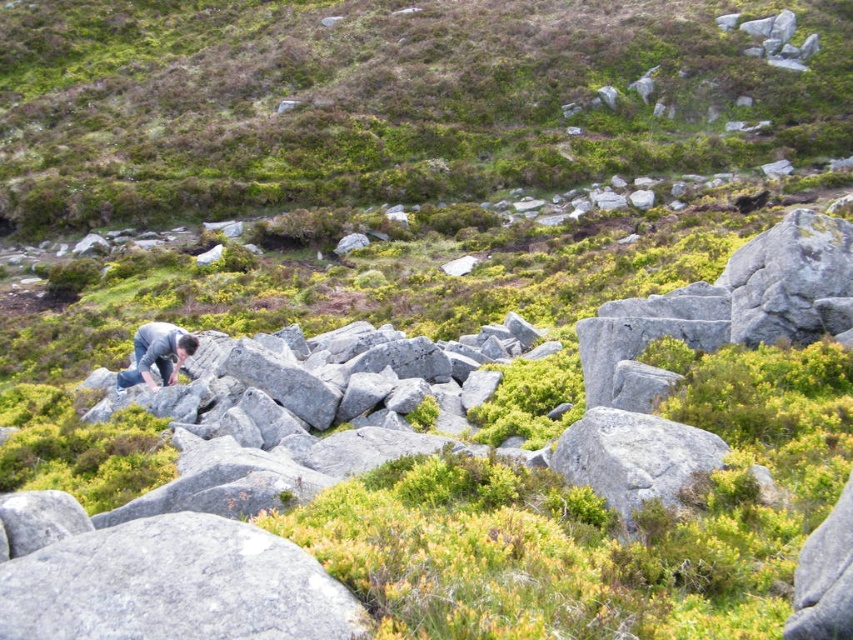
Question: Which object is positioned closest to the gray rough boulder at lower left?

Choices:
 (A) gray rough boulder at center-right
 (B) dark gray fabric at lower left

Answer: (A)

Question: In this image, where is gray rough boulder at lower left located relative to dark gray fabric at lower left?

Choices:
 (A) right
 (B) left

Answer: (A)

Question: Which object is farther from the camera taking this photo?

Choices:
 (A) gray rough boulder at center-right
 (B) dark gray fabric at lower left

Answer: (B)

Question: Is gray rough boulder at lower left in front of gray rough boulder at center-right?

Choices:
 (A) no
 (B) yes

Answer: (B)

Question: Which point is closer to the camera?

Choices:
 (A) dark gray fabric at lower left
 (B) gray rough boulder at center-right

Answer: (B)

Question: Does gray rough boulder at lower left have a smaller size compared to gray rough boulder at center-right?

Choices:
 (A) no
 (B) yes

Answer: (B)